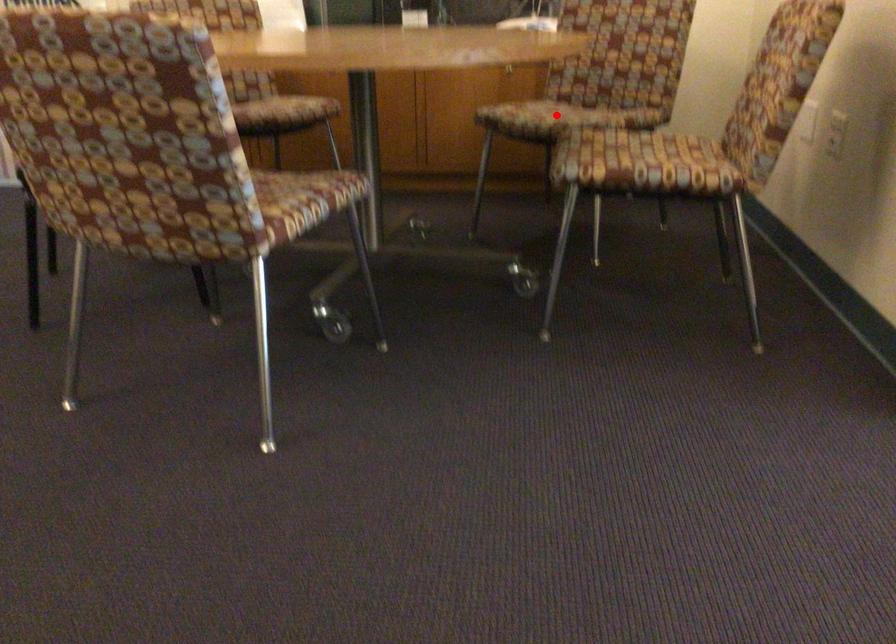
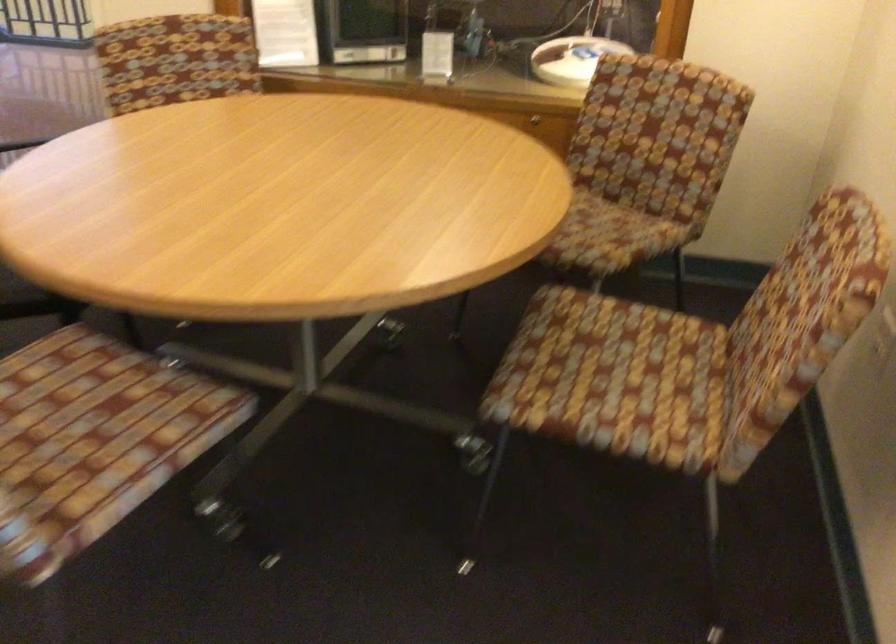
Question: I am providing you with two images of the same scene from different viewpoints. A red point is marked on the first image. At the location where the point appears in image 1, is it still visible in image 2?

Choices:
 (A) Yes
 (B) No

Answer: (B)